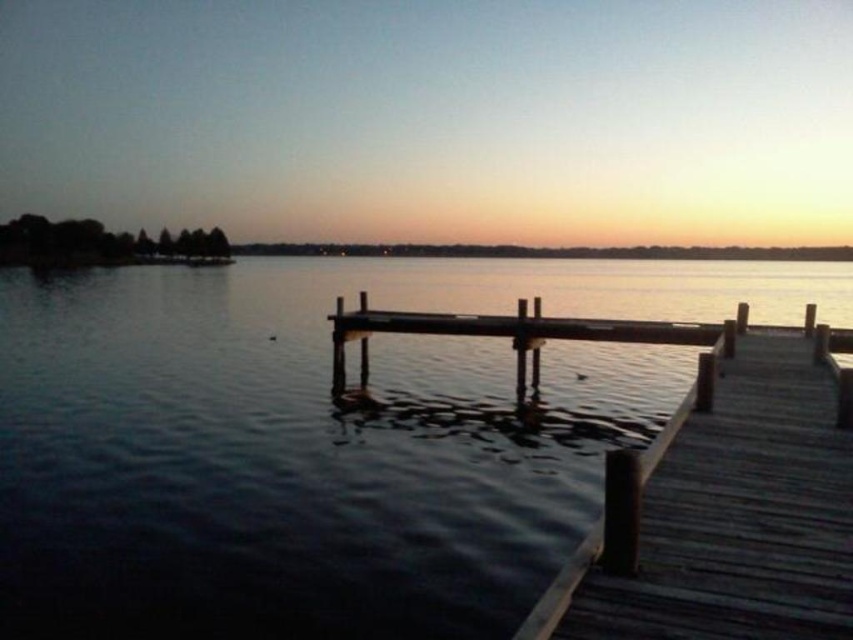
You are standing on the wooden dock at center and want to jump into the water. Which direction should you jump to ensure you land in the smooth water at center?

You should jump toward the center of the scene because the smooth water at center is larger in size than the wooden dock at center, meaning there is more space for you to land safely in the water.

You are standing at the point labeled as point [0,620] and want to walk to the dock. The dock is 15 feet away from you. Can you reach the dock without walking more than 15 feet?

The distance between you and the dock is 20.15 feet, which is more than 15 feet. Therefore, you cannot reach the dock without walking more than 15 feet.